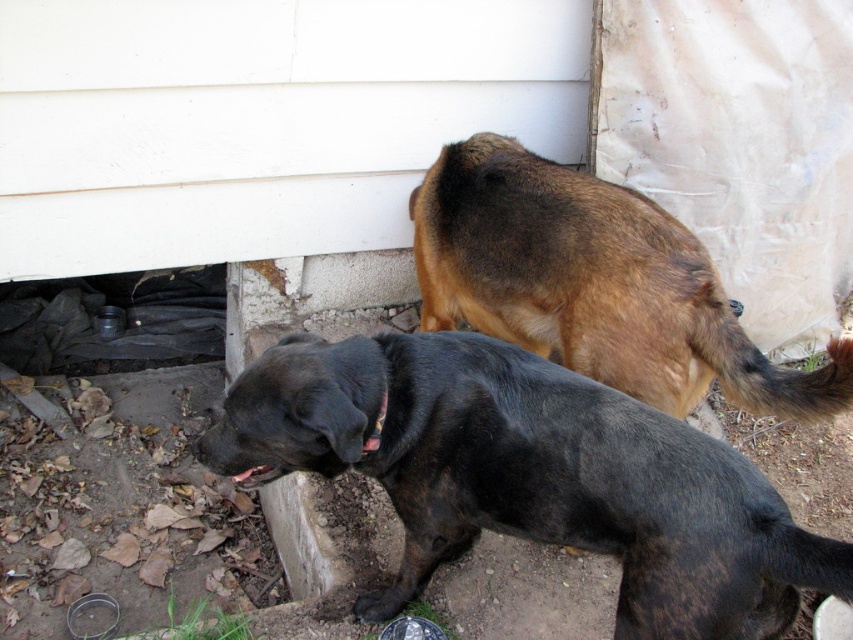
Question: Can you confirm if black matte dog at lower center is bigger than black fabric neckband at lower center?

Choices:
 (A) yes
 (B) no

Answer: (A)

Question: Based on their relative distances, which object is farther from the brown furry dog at upper right?

Choices:
 (A) black fabric neckband at lower center
 (B) black matte dog at lower center

Answer: (A)

Question: Based on their relative distances, which object is nearer to the black fabric neckband at lower center?

Choices:
 (A) black matte dog at lower center
 (B) brown furry dog at upper right

Answer: (A)

Question: Does brown furry dog at upper right appear on the left side of black fabric neckband at lower center?

Choices:
 (A) yes
 (B) no

Answer: (B)

Question: Which point is closer to the camera?

Choices:
 (A) black matte dog at lower center
 (B) black fabric neckband at lower center

Answer: (A)

Question: Does black matte dog at lower center lie in front of brown furry dog at upper right?

Choices:
 (A) no
 (B) yes

Answer: (B)